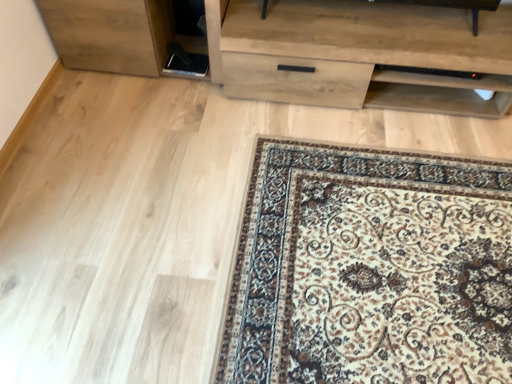
You are a GUI agent. You are given a task and a screenshot of the screen. Output one action in this format:
    pyautogui.click(x=<x>, y=<y>)
    Task: Click on the light wood/texture chest of drawers at upper center
    The width and height of the screenshot is (512, 384).
    Given the screenshot: What is the action you would take?
    pyautogui.click(x=359, y=54)

The height and width of the screenshot is (384, 512). Describe the element at coordinates (359, 54) in the screenshot. I see `light wood/texture chest of drawers at upper center` at that location.

You are a GUI agent. You are given a task and a screenshot of the screen. Output one action in this format:
    pyautogui.click(x=<x>, y=<y>)
    Task: Click on the light wood/texture chest of drawers at upper center
    This screenshot has height=384, width=512.
    Given the screenshot: What is the action you would take?
    359,54